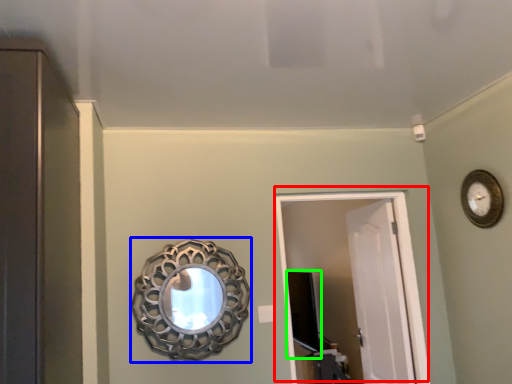
Question: Estimate the real-world distances between objects in this image. Which object is farther from door (highlighted by a red box), mirror (highlighted by a blue box) or medicine cabinet (highlighted by a green box)?

Choices:
 (A) mirror
 (B) medicine cabinet

Answer: (A)